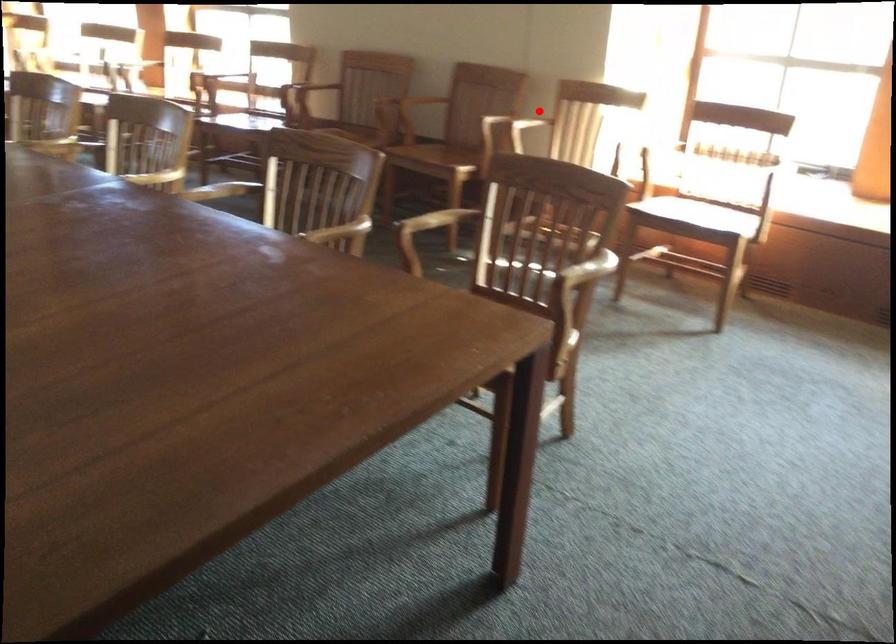
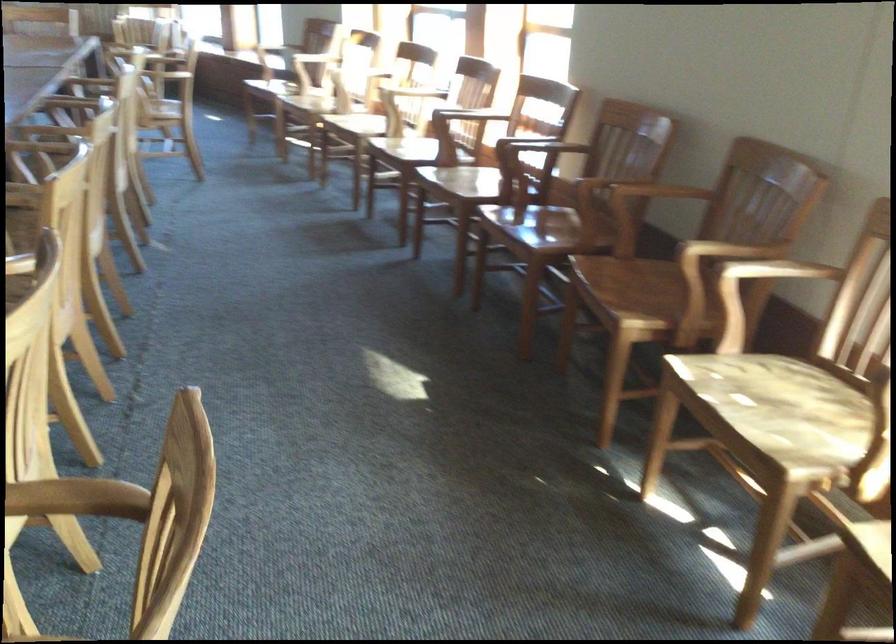
Find the pixel in the second image that matches the highlighted location in the first image.

(776, 270)